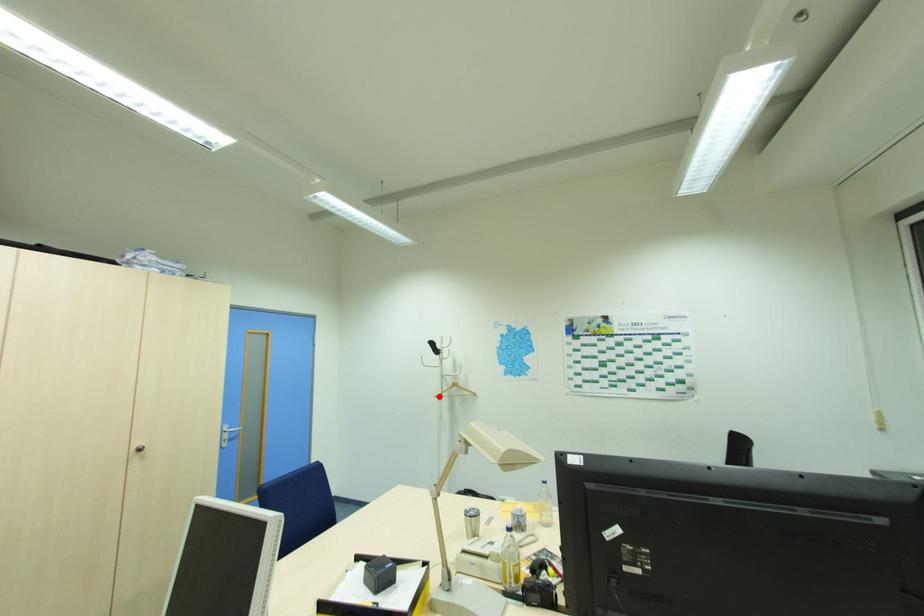
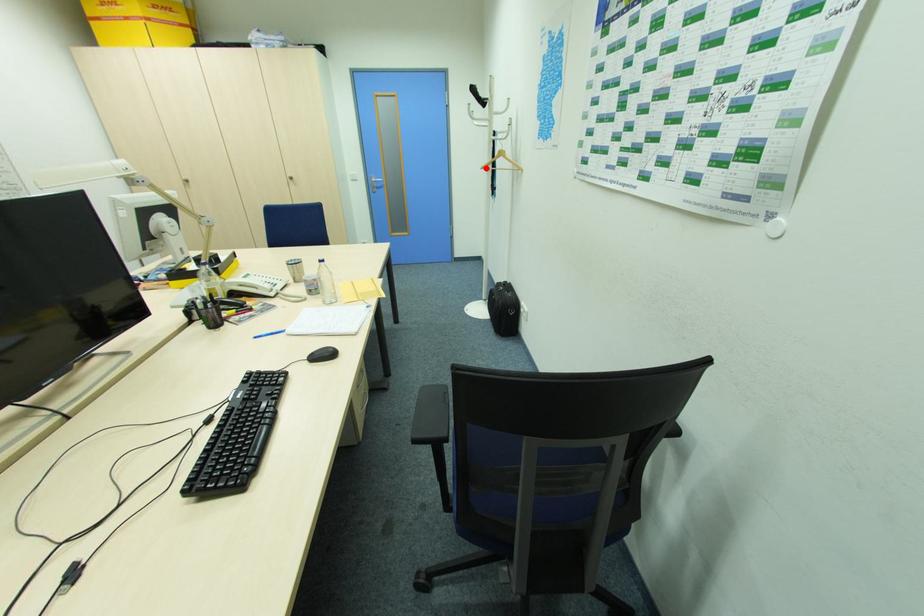
I am providing you with two images of the same scene from different viewpoints. A red point is marked on the first image and another point is marked on the second image. Does the point marked in image1 correspond to the same location as the one in image2?

Yes